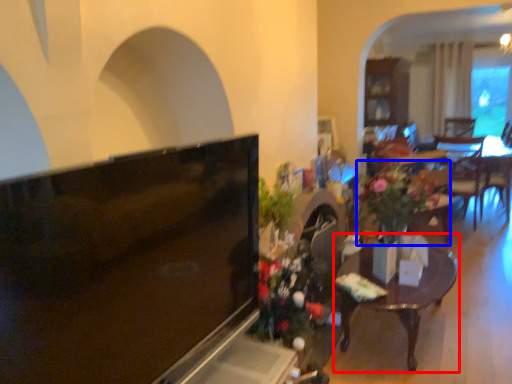
Question: Among these objects, which one is nearest to the camera, table (highlighted by a red box) or houseplant (highlighted by a blue box)?

Choices:
 (A) table
 (B) houseplant

Answer: (A)